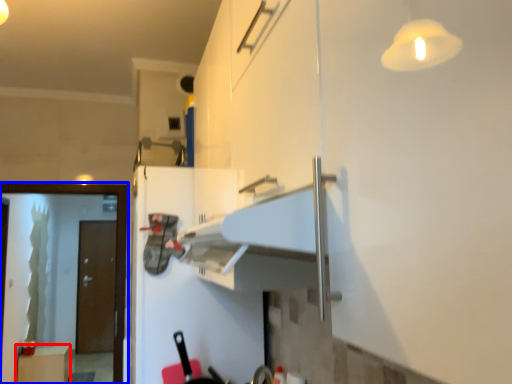
Question: Among these objects, which one is nearest to the camera, cabinetry (highlighted by a red box) or screen door (highlighted by a blue box)?

Choices:
 (A) cabinetry
 (B) screen door

Answer: (B)